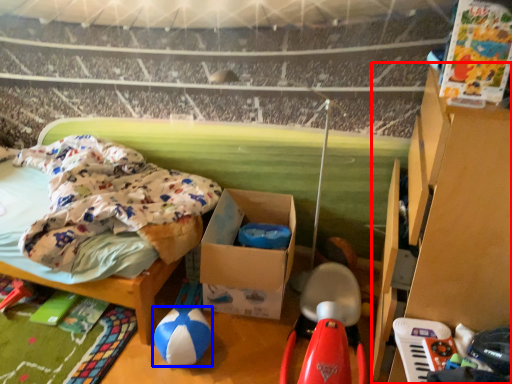
Question: Which object appears closest to the camera in this image, furniture (highlighted by a red box) or toy (highlighted by a blue box)?

Choices:
 (A) furniture
 (B) toy

Answer: (A)